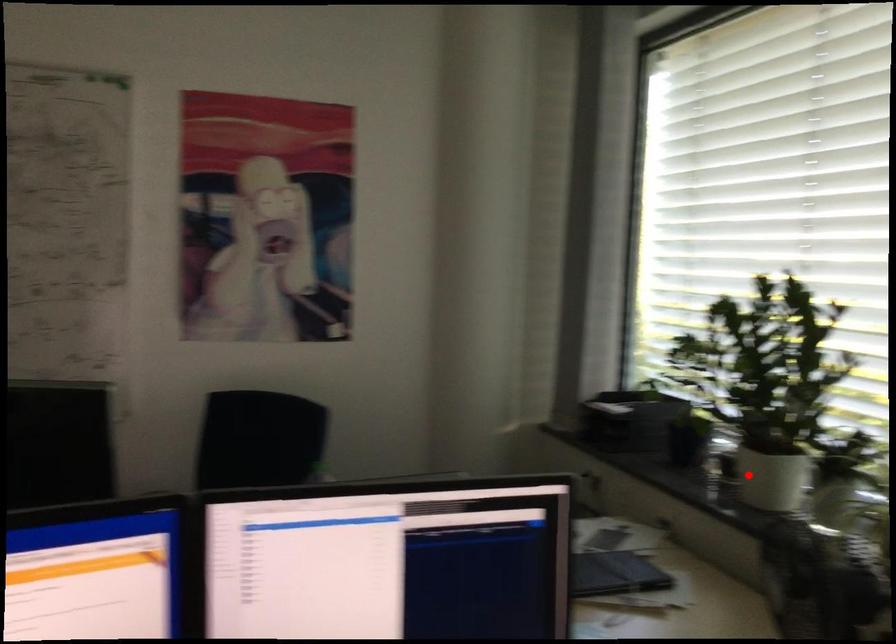
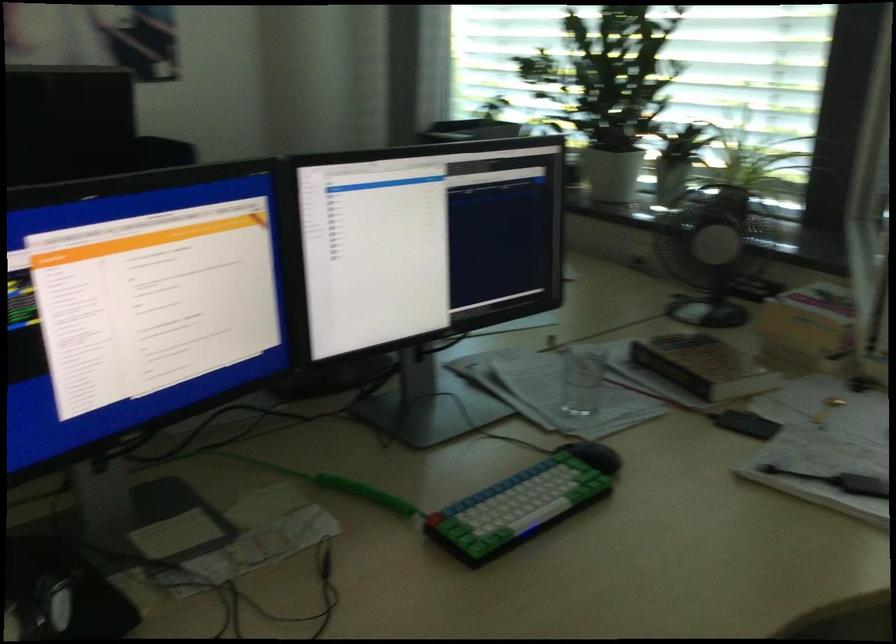
The point at the highlighted location is marked in the first image. Where is the corresponding point in the second image?

(612, 174)